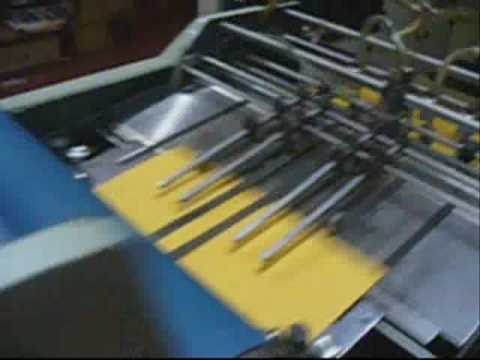
Where is `rod`? This screenshot has height=360, width=480. rod is located at coordinates (282, 205).